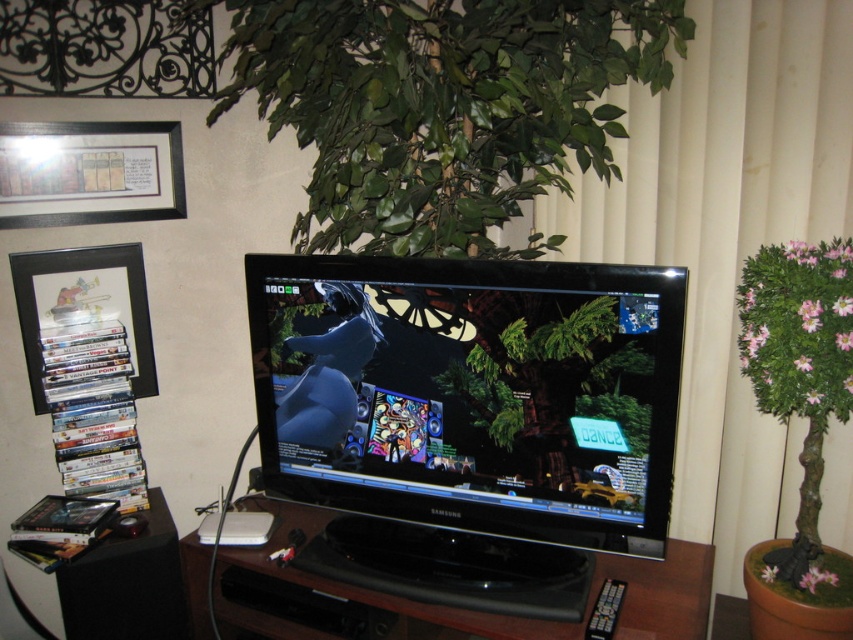
You are moving a large plant that is 1.2 meters wide and want to place it between the black wood tv stand at center and the black plastic picture frame at left. Based on their widths, will the plant fit in the space between them?

The black wood tv stand at center might be wider than black plastic picture frame at left, so the space between them may not be wide enough to accommodate the 1.2 meter wide plant. It depends on the exact width difference.

You are a delivery person trying to place a large package that is 2 feet wide on the floor between the white textured curtain at upper right and the black wood tv stand at center. Can the package fit in that space?

The distance between the white textured curtain at upper right and the black wood tv stand at center is 25.87 inches. Since the package is 2 feet wide, which is 24 inches, there is enough space for it to fit with about 1.87 inches to spare.